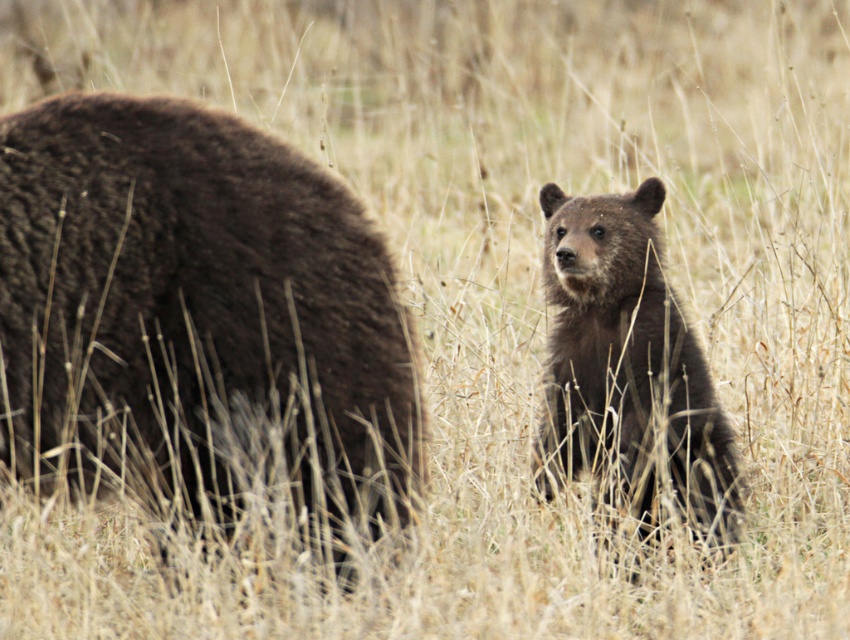
Question: Where is dark brown fur at left located in relation to dark brown fur bear at center in the image?

Choices:
 (A) left
 (B) right

Answer: (A)

Question: Is dark brown fur at left behind dark brown fur bear at center?

Choices:
 (A) yes
 (B) no

Answer: (B)

Question: Is dark brown fur at left to the left of dark brown fur bear at center from the viewer's perspective?

Choices:
 (A) yes
 (B) no

Answer: (A)

Question: Among these objects, which one is nearest to the camera?

Choices:
 (A) dark brown fur bear at center
 (B) dark brown fur at left

Answer: (B)

Question: Among these objects, which one is farthest from the camera?

Choices:
 (A) dark brown fur bear at center
 (B) dark brown fur at left

Answer: (A)